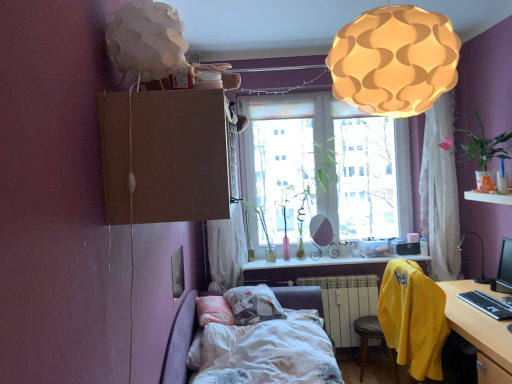
Question: From a real-world perspective, is wooden desk at lower right positioned above or below green leafy plant at upper right, which is the fourth plant in left-to-right order?

Choices:
 (A) below
 (B) above

Answer: (A)

Question: In terms of width, does wooden desk at lower right look wider or thinner when compared to green leafy plant at upper right, marked as the fourth plant in a back-to-front arrangement?

Choices:
 (A) thin
 (B) wide

Answer: (B)

Question: Estimate the real-world distances between objects in this image. Which object is closer to the black plastic table lamp at right?

Choices:
 (A) matte white lampshade at upper center, which is the first lamp from back to front
 (B) white sheer curtain at upper right, which appears as the 1th curtain when viewed from the right
 (C) green glass vase at window, the 3th plant from the back
 (D) black glossy monitor at right
 (E) white painted metal radiator at lower center

Answer: (D)

Question: Which object is positioned farthest from the black plastic table lamp at right?

Choices:
 (A) translucent glass window at center
 (B) clear glass vase at center, the 1th window sill from the top
 (C) black plastic keyboard at lower right
 (D) translucent glass vase at window, the second plant when ordered from left to right
 (E) green glass vase at window, which is the 2th plant from right to left

Answer: (D)